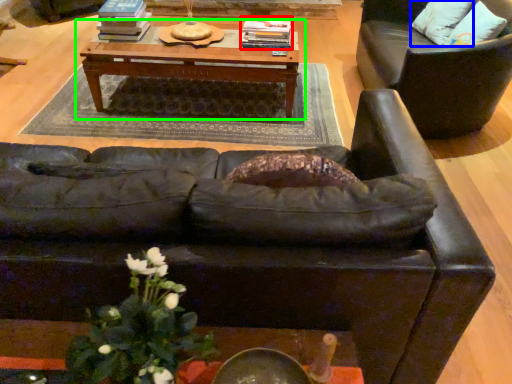
Question: Which is nearer to the book (highlighted by a red box)? pillow (highlighted by a blue box) or table (highlighted by a green box).

Choices:
 (A) pillow
 (B) table

Answer: (B)